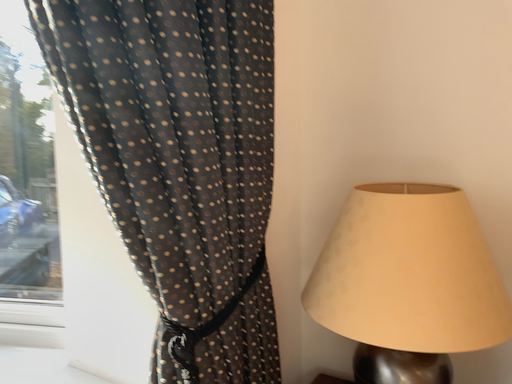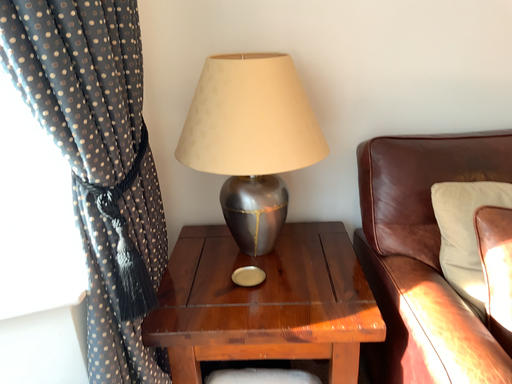
Question: How did the camera likely rotate when shooting the video?

Choices:
 (A) rotated left
 (B) rotated right

Answer: (B)